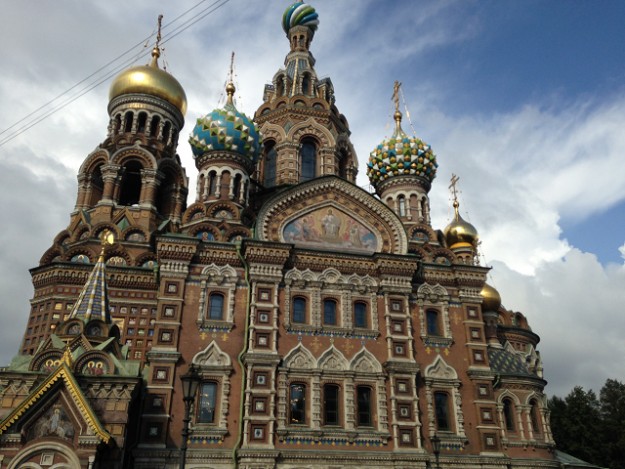
At what (x,y) coordinates should I click in order to perform the action: click on painting. Please return your answer as a coordinate pair (x, y). The width and height of the screenshot is (625, 469). Looking at the image, I should click on (305, 228), (334, 223), (349, 233).